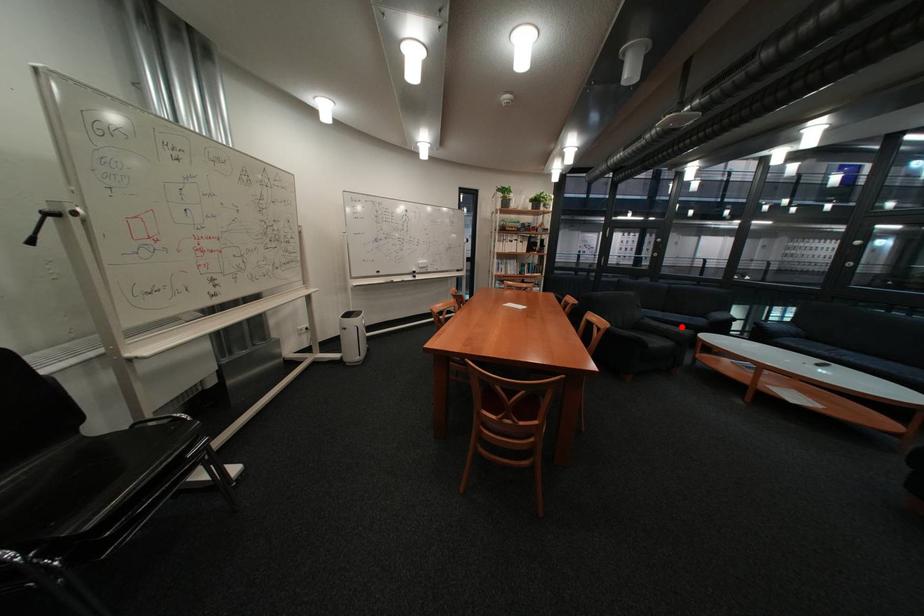
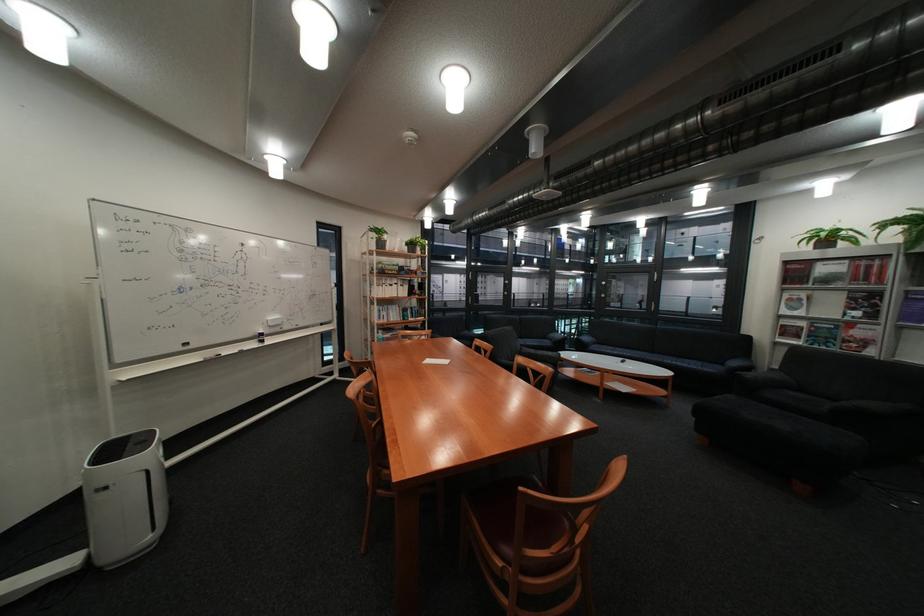
Find the pixel in the second image that matches the highlighted location in the first image.

(555, 353)